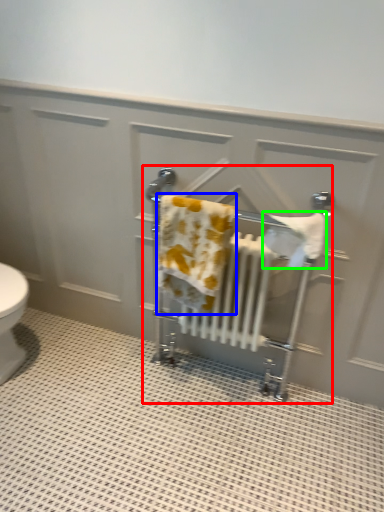
Question: Which object is positioned farthest from baby carriage (highlighted by a red box)? Select from bath towel (highlighted by a blue box) and bath towel (highlighted by a green box).

Choices:
 (A) bath towel
 (B) bath towel

Answer: (A)